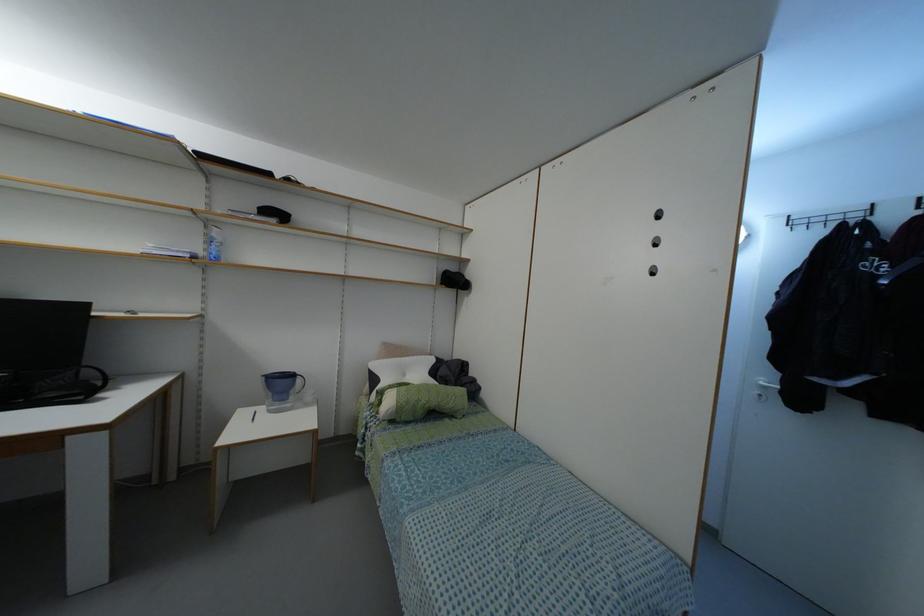
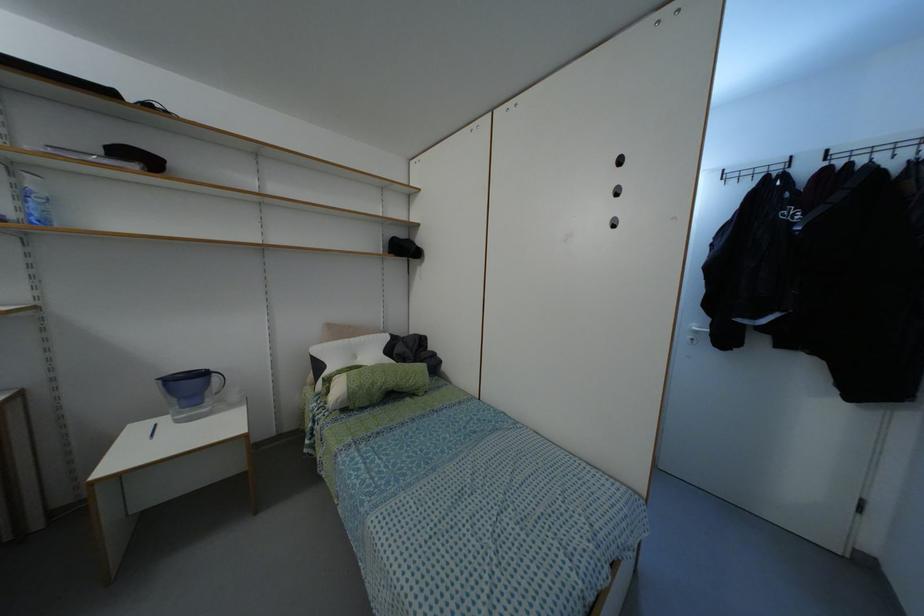
Where in the second image is the point corresponding to the point at 766,378 from the first image?

(698, 323)